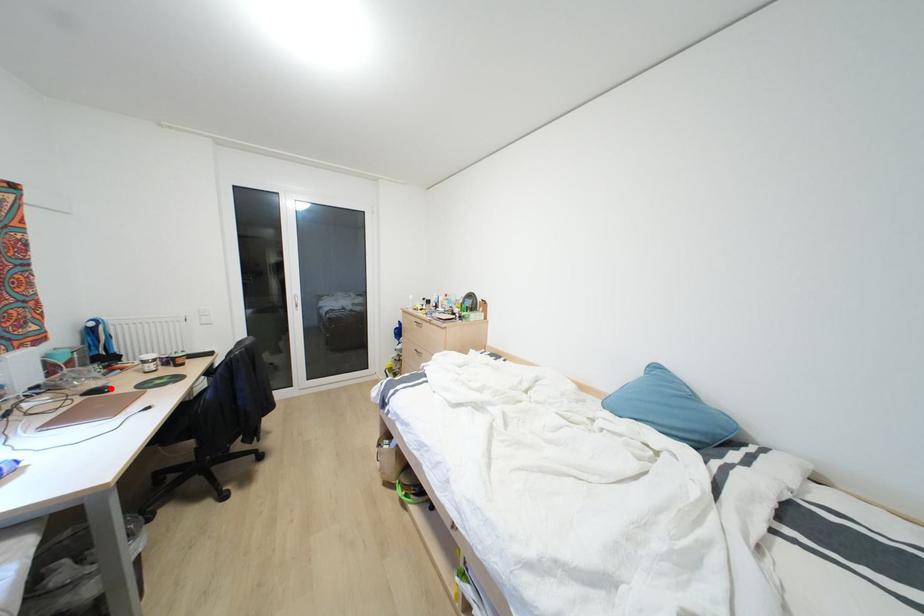
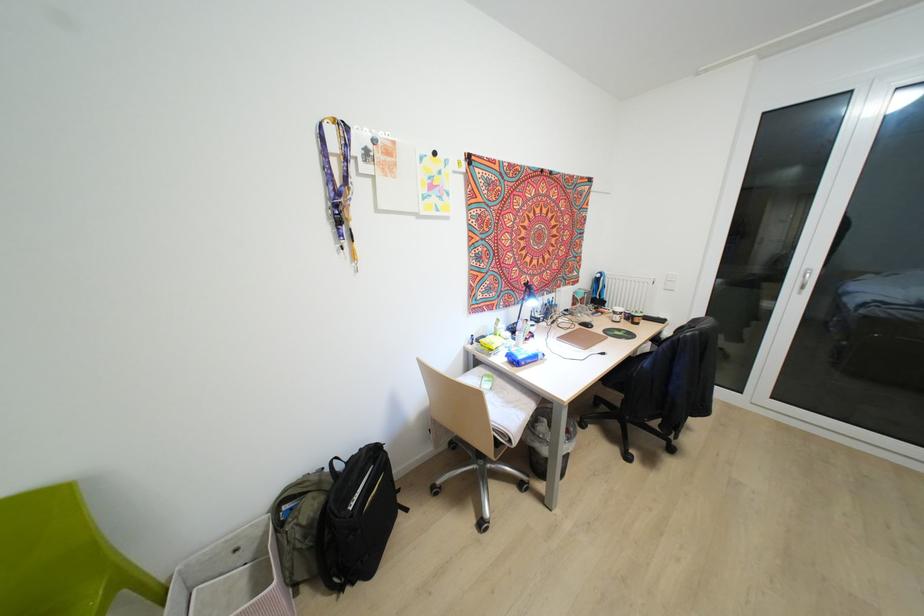
Where in the second image is the point corresponding to the highlighted location from the first image?

(591, 326)